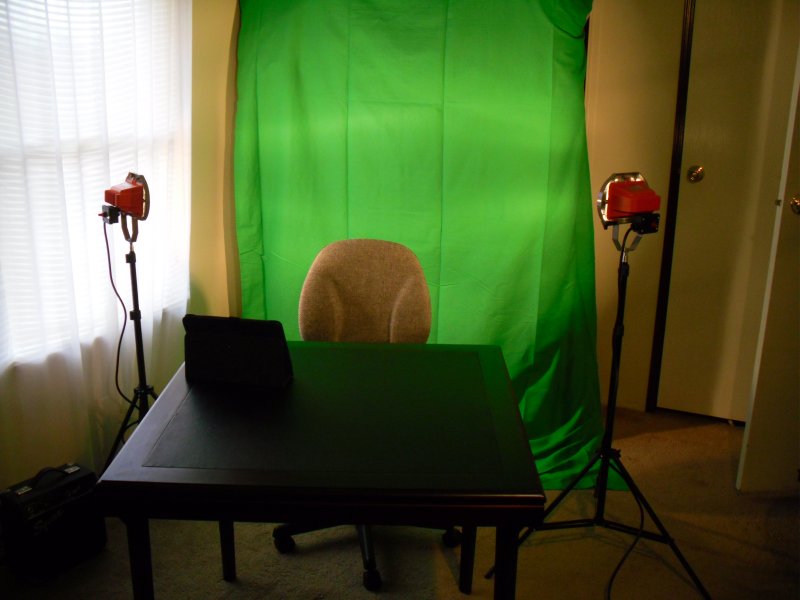
Find the location of `chair`. chair is located at coordinates (374, 306).